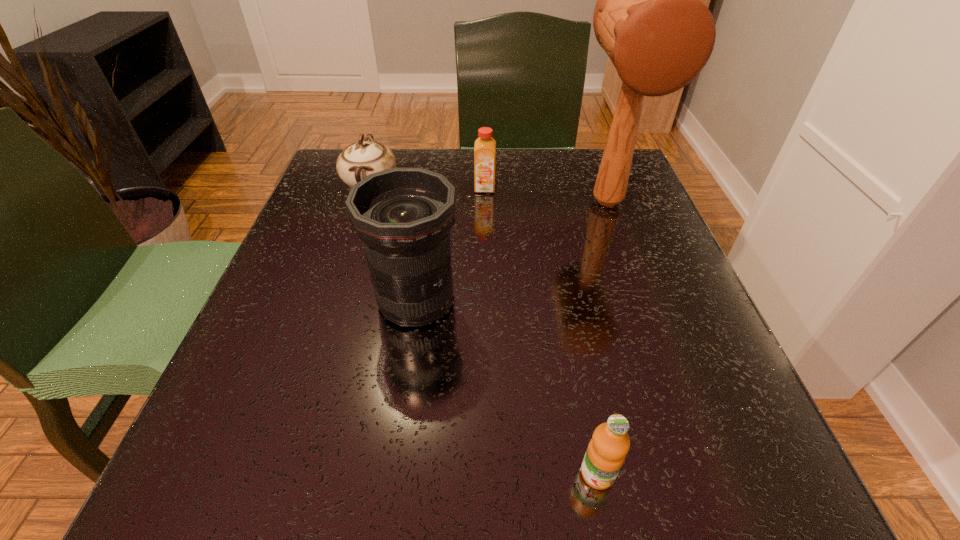
At what (x,y) coordinates should I click in order to perform the action: click on the rightmost object. Please return your answer as a coordinate pair (x, y). This screenshot has width=960, height=540. Looking at the image, I should click on (649, 18).

Identify the location of the tallest object. (649, 18).

Identify the location of the fourth farthest object. This screenshot has width=960, height=540. (403, 215).

Locate an element on the screen. The width and height of the screenshot is (960, 540). the fourth object from right to left is located at coordinates (403, 215).

Find the location of a particular element. This screenshot has width=960, height=540. the left orange juice is located at coordinates (485, 146).

Where is `the farther orange juice`? The width and height of the screenshot is (960, 540). the farther orange juice is located at coordinates [x=485, y=146].

This screenshot has height=540, width=960. I want to click on chinaware, so click(358, 160).

Where is `the fourth object from left to right`? The image size is (960, 540). the fourth object from left to right is located at coordinates (605, 455).

The height and width of the screenshot is (540, 960). I want to click on the nearest object, so click(605, 455).

What are the coordinates of `free space located on the strike surface of the rightmost object` in the screenshot? It's located at (645, 307).